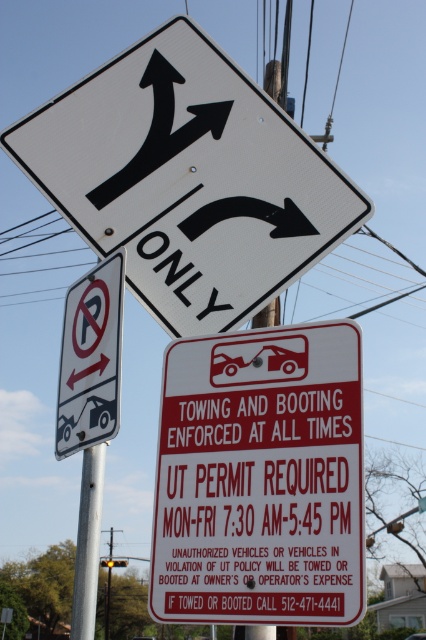
You are driving a metallic silver car at center and want to park near the silver metallic pole at center. According to the traffic signs on the pole, can you park here without getting a ticket?

The smaller rectangular sign with a red circle and a diagonal line through a P symbol indicates no parking, so you cannot park here without getting a ticket.